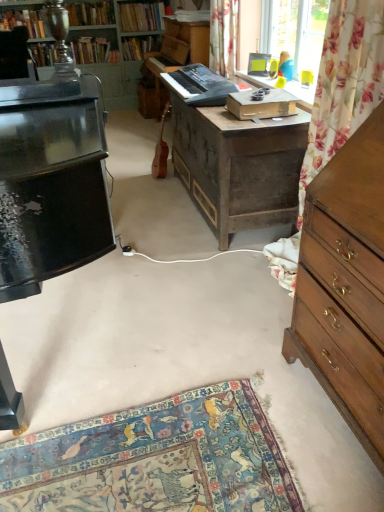
Locate an element on the screen. vacant space that's between wooden desk at center and floral fabric at upper right is located at coordinates (251, 271).